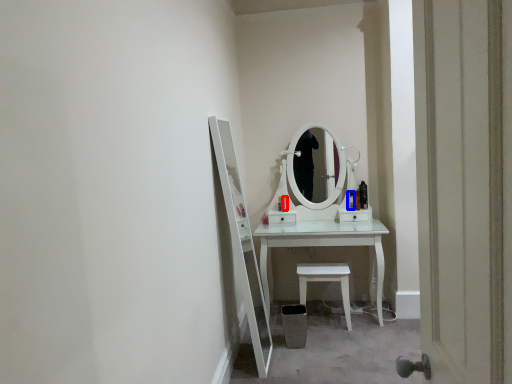
Question: Which object appears closest to the camera in this image, toiletry (highlighted by a red box) or toiletry (highlighted by a blue box)?

Choices:
 (A) toiletry
 (B) toiletry

Answer: (B)